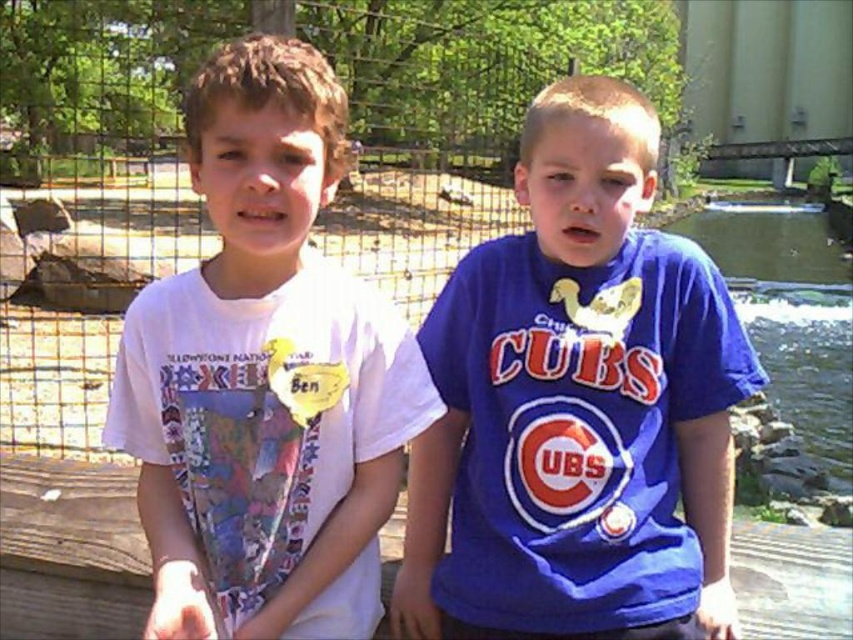
Question: Which is nearer to the metal mesh fence at center?

Choices:
 (A) blue fabric shirt at center
 (B) clear water at creek right

Answer: (B)

Question: Which point is closer to the camera?

Choices:
 (A) (35, 257)
 (B) (346, 356)
 (C) (838, 321)
 (D) (651, 364)

Answer: (B)

Question: Does blue fabric shirt at center have a larger size compared to metal mesh fence at center?

Choices:
 (A) no
 (B) yes

Answer: (A)

Question: Does blue fabric shirt at center appear on the left side of metal mesh fence at center?

Choices:
 (A) no
 (B) yes

Answer: (A)

Question: Does blue fabric shirt at center appear under white printed t-shirt at center?

Choices:
 (A) no
 (B) yes

Answer: (A)

Question: Considering the real-world distances, which object is farthest from the clear water at creek right?

Choices:
 (A) white printed t-shirt at center
 (B) metal mesh fence at center

Answer: (A)